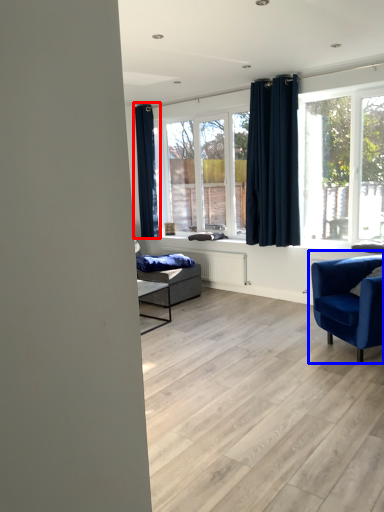
Question: Which point is further to the camera, curtain (highlighted by a red box) or chair (highlighted by a blue box)?

Choices:
 (A) curtain
 (B) chair

Answer: (A)